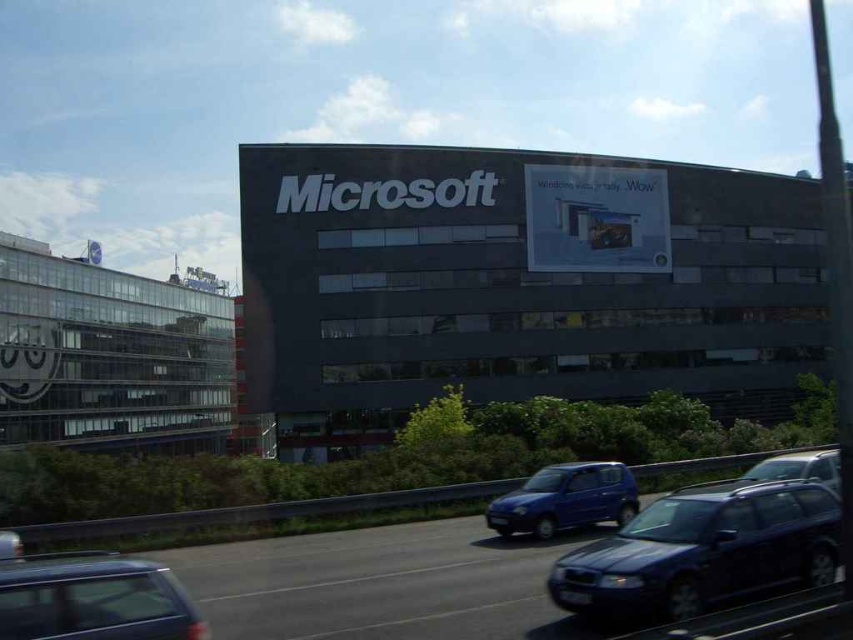
Question: Where is black asphalt highway at lower center located in relation to matte black car at lower left in the image?

Choices:
 (A) right
 (B) left

Answer: (A)

Question: Is metallic blue station wagon at center to the right of metallic silver car at center from the viewer's perspective?

Choices:
 (A) no
 (B) yes

Answer: (A)

Question: Which is nearer to the matte black car at lower left?

Choices:
 (A) metallic blue station wagon at center
 (B) matte blue hatchback at center
 (C) metallic silver car at center

Answer: (A)

Question: Which point is closer to the camera?

Choices:
 (A) matte black car at lower left
 (B) metallic silver car at center
 (C) matte blue hatchback at center

Answer: (A)

Question: Among these objects, which one is nearest to the camera?

Choices:
 (A) black asphalt highway at lower center
 (B) matte black car at lower left
 (C) metallic blue station wagon at center
 (D) matte blue hatchback at center

Answer: (B)

Question: Does matte black car at lower left appear on the left side of matte blue hatchback at center?

Choices:
 (A) no
 (B) yes

Answer: (B)